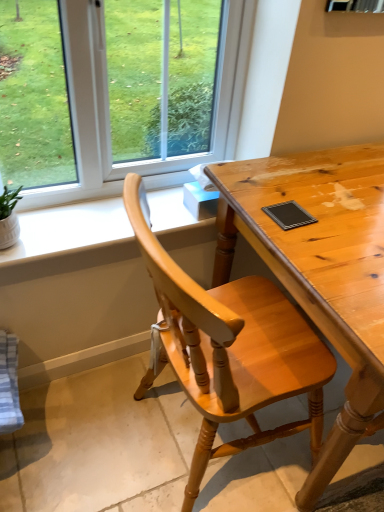
Question: Is white matte window sill at upper left bigger than light brown wooden chair at center?

Choices:
 (A) yes
 (B) no

Answer: (B)

Question: From the image's perspective, is white matte window sill at upper left above light brown wooden chair at center?

Choices:
 (A) no
 (B) yes

Answer: (B)

Question: Can you confirm if white matte window sill at upper left is smaller than light brown wooden chair at center?

Choices:
 (A) yes
 (B) no

Answer: (A)

Question: From a real-world perspective, is white matte window sill at upper left positioned under light brown wooden chair at center based on gravity?

Choices:
 (A) yes
 (B) no

Answer: (B)

Question: Is white matte window sill at upper left oriented towards light brown wooden chair at center?

Choices:
 (A) yes
 (B) no

Answer: (A)

Question: Is light brown wooden desk at center spatially inside light brown wooden chair at center, or outside of it?

Choices:
 (A) inside
 (B) outside

Answer: (B)

Question: Is point (314, 201) positioned closer to the camera than point (273, 437)?

Choices:
 (A) farther
 (B) closer

Answer: (B)

Question: In terms of height, does light brown wooden desk at center look taller or shorter compared to light brown wooden chair at center?

Choices:
 (A) short
 (B) tall

Answer: (A)

Question: From a real-world perspective, relative to light brown wooden chair at center, is light brown wooden desk at center vertically above or below?

Choices:
 (A) below
 (B) above

Answer: (A)

Question: From the image's perspective, is white matte window sill at upper left positioned above or below light brown wooden chair at center?

Choices:
 (A) above
 (B) below

Answer: (A)

Question: Is point (74, 232) closer or farther from the camera than point (278, 379)?

Choices:
 (A) closer
 (B) farther

Answer: (B)

Question: From a real-world perspective, relative to light brown wooden chair at center, is white matte window sill at upper left vertically above or below?

Choices:
 (A) below
 (B) above

Answer: (B)

Question: Would you say white matte window sill at upper left is to the left or to the right of light brown wooden chair at center in the picture?

Choices:
 (A) left
 (B) right

Answer: (A)

Question: From the image's perspective, is white matte window sill at upper left positioned above or below light brown wooden desk at center?

Choices:
 (A) below
 (B) above

Answer: (B)

Question: Considering the relative positions of white matte window sill at upper left and light brown wooden desk at center in the image provided, is white matte window sill at upper left to the left or to the right of light brown wooden desk at center?

Choices:
 (A) left
 (B) right

Answer: (A)